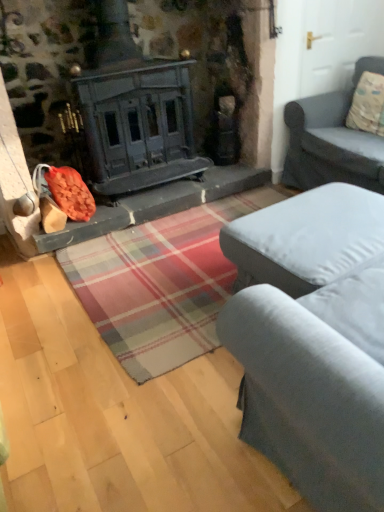
Question: Considering the positions of gray fabric couch at right, acting as the 2th studio couch starting from the bottom, and gray fabric ottoman at center, which is counted as the 1th studio couch, starting from the front, in the image, is gray fabric couch at right, acting as the 2th studio couch starting from the bottom, bigger or smaller than gray fabric ottoman at center, which is counted as the 1th studio couch, starting from the front,?

Choices:
 (A) small
 (B) big

Answer: (B)

Question: Do you think gray fabric couch at right, the 1th studio couch viewed from the top, is within gray fabric ottoman at center, positioned as the second studio couch in back-to-front order, or outside of it?

Choices:
 (A) outside
 (B) inside

Answer: (A)

Question: Which object is the farthest from the gray fabric ottoman at center, positioned as the second studio couch in back-to-front order?

Choices:
 (A) fluffy beige pillow at upper right
 (B) gray fabric couch at right, which is the 1th studio couch in back-to-front order

Answer: (A)

Question: Which object is the closest to the gray fabric ottoman at center, positioned as the second studio couch in back-to-front order?

Choices:
 (A) fluffy beige pillow at upper right
 (B) gray fabric couch at right, which is the 1th studio couch in back-to-front order

Answer: (B)